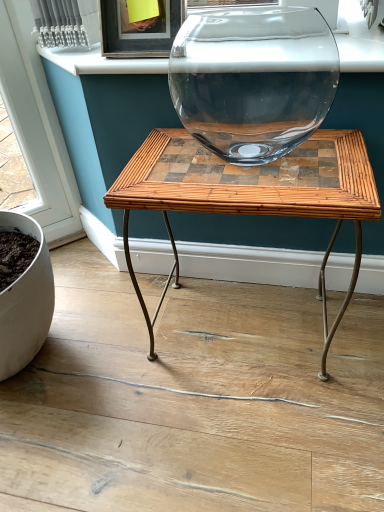
Question: From a real-world perspective, relative to bamboo/rattan table at center, is white glossy window sill at upper center vertically above or below?

Choices:
 (A) above
 (B) below

Answer: (A)

Question: Is white glossy window sill at upper center to the left or to the right of bamboo/rattan table at center in the image?

Choices:
 (A) right
 (B) left

Answer: (B)

Question: Would you say white glossy window sill at upper center is inside or outside bamboo/rattan table at center?

Choices:
 (A) inside
 (B) outside

Answer: (B)

Question: Considering the positions of bamboo/rattan table at center and white glossy window sill at upper center in the image, is bamboo/rattan table at center taller or shorter than white glossy window sill at upper center?

Choices:
 (A) short
 (B) tall

Answer: (B)

Question: Is bamboo/rattan table at center situated inside white glossy window sill at upper center or outside?

Choices:
 (A) inside
 (B) outside

Answer: (B)

Question: Looking at their shapes, would you say bamboo/rattan table at center is wider or thinner than white glossy window sill at upper center?

Choices:
 (A) wide
 (B) thin

Answer: (A)

Question: Would you say bamboo/rattan table at center is to the left or to the right of white glossy window sill at upper center in the picture?

Choices:
 (A) left
 (B) right

Answer: (B)